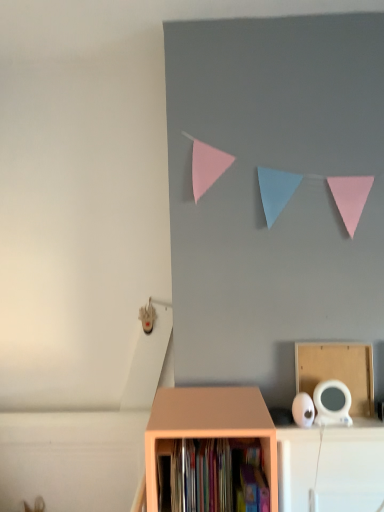
Image resolution: width=384 pixels, height=512 pixels. What are the coordinates of `matte wood shelf at lower center` in the screenshot? It's located at 209,425.

Measure the distance between matte wood shelf at lower center and camera.

3.60 feet.

The width and height of the screenshot is (384, 512). I want to click on cardboard at upper right, so click(338, 371).

Does matte wood shelf at lower center have a greater height compared to hardcover books at center?

Yes, matte wood shelf at lower center is taller than hardcover books at center.

In terms of width, does matte wood shelf at lower center look wider or thinner when compared to hardcover books at center?

matte wood shelf at lower center is wider than hardcover books at center.

From the image's perspective, is matte wood shelf at lower center above or below hardcover books at center?

matte wood shelf at lower center is situated lower than hardcover books at center in the image.

Is matte wood shelf at lower center far away from hardcover books at center?

No, matte wood shelf at lower center is in close proximity to hardcover books at center.

Is hardcover books at center bigger or smaller than cardboard at upper right?

Clearly, hardcover books at center is larger in size than cardboard at upper right.

Are hardcover books at center and cardboard at upper right located far from each other?

Actually, hardcover books at center and cardboard at upper right are a little close together.

This screenshot has height=512, width=384. What are the coordinates of `cardboard box above the hardcover books at center (from the image's perspective)` in the screenshot? It's located at (338, 371).

How many degrees apart are the facing directions of hardcover books at center and cardboard at upper right?

The angle between the facing direction of hardcover books at center and the facing direction of cardboard at upper right is 0.518 degrees.

Does point (251, 406) appear closer or farther from the camera than point (314, 346)?

Point (251, 406) appears to be closer to the viewer than point (314, 346).

What's the angular difference between matte wood shelf at lower center and cardboard at upper right's facing directions?

0.249 degrees separate the facing orientations of matte wood shelf at lower center and cardboard at upper right.

In terms of size, does matte wood shelf at lower center appear bigger or smaller than cardboard at upper right?

Clearly, matte wood shelf at lower center is larger in size than cardboard at upper right.

From the image's perspective, between matte wood shelf at lower center and cardboard at upper right, who is located below?

matte wood shelf at lower center appears lower in the image.

Does cardboard at upper right appear on the left side of matte wood shelf at lower center?

In fact, cardboard at upper right is to the right of matte wood shelf at lower center.

Consider the image. From the image's perspective, is cardboard at upper right located beneath matte wood shelf at lower center?

Incorrect, from the image's perspective, cardboard at upper right is higher than matte wood shelf at lower center.

Is cardboard at upper right closer to the viewer compared to matte wood shelf at lower center?

No, cardboard at upper right is further to the viewer.

Which is nearer, (365, 373) or (201, 433)?

Point (365, 373) is farther from the camera than point (201, 433).

This screenshot has height=512, width=384. What are the coordinates of `book above the matte wood shelf at lower center (from a real-world perspective)` in the screenshot? It's located at (212, 476).

Does hardcover books at center have a greater width compared to matte wood shelf at lower center?

No, hardcover books at center is not wider than matte wood shelf at lower center.

Is hardcover books at center in front of or behind matte wood shelf at lower center in the image?

Visually, hardcover books at center is located behind matte wood shelf at lower center.

From a real-world perspective, which is physically above, hardcover books at center or matte wood shelf at lower center?

Result: hardcover books at center.

Are cardboard at upper right and hardcover books at center beside each other?

No, cardboard at upper right is not making contact with hardcover books at center.

Can you confirm if cardboard at upper right is thinner than hardcover books at center?

Yes.

Between point (301, 346) and point (203, 471), which one is positioned behind?

The point (301, 346) is farther from the camera.

The width and height of the screenshot is (384, 512). I want to click on shelf on the left of hardcover books at center, so click(x=209, y=425).

What are the coordinates of `cardboard box above the hardcover books at center (from a real-world perspective)` in the screenshot? It's located at (338, 371).

Considering their positions, is cardboard at upper right positioned closer to hardcover books at center than matte wood shelf at lower center?

matte wood shelf at lower center lies closer to hardcover books at center than the other object.

Looking at the image, which one is located further to cardboard at upper right, matte wood shelf at lower center or hardcover books at center?

hardcover books at center.

Which object lies nearer to the anchor point matte wood shelf at lower center, cardboard at upper right or hardcover books at center?

hardcover books at center is closer to matte wood shelf at lower center.

Which object lies nearer to the anchor point hardcover books at center, matte wood shelf at lower center or cardboard at upper right?

matte wood shelf at lower center is closer to hardcover books at center.

Which object lies further to the anchor point matte wood shelf at lower center, hardcover books at center or cardboard at upper right?

cardboard at upper right.

From the image, which object appears to be farther from cardboard at upper right, hardcover books at center or matte wood shelf at lower center?

hardcover books at center is positioned further to the anchor cardboard at upper right.

The width and height of the screenshot is (384, 512). In order to click on book situated between matte wood shelf at lower center and cardboard at upper right from left to right in this screenshot , I will do `click(212, 476)`.